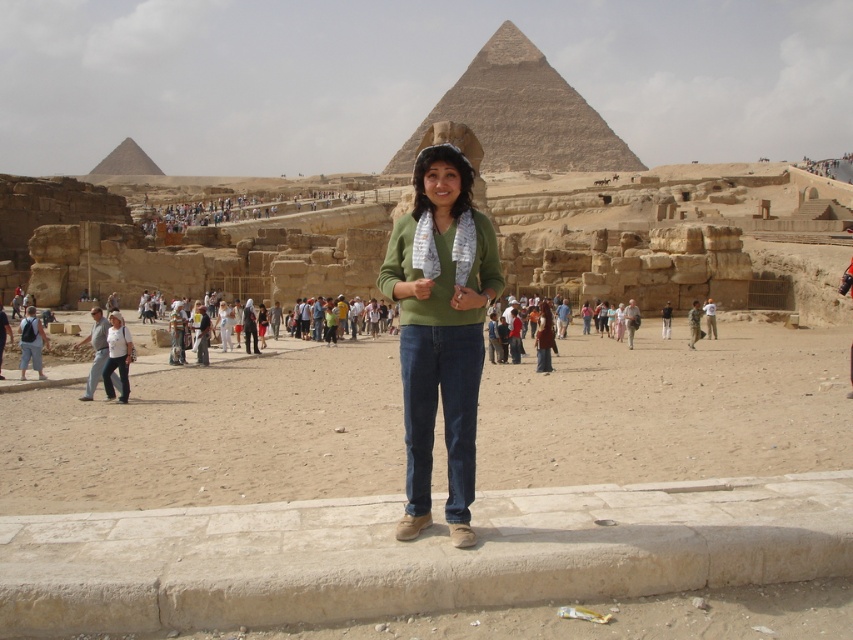
Question: Which point is closer to the camera?

Choices:
 (A) light blue jeans at center
 (B) green sweater at center

Answer: (A)

Question: Considering the real-world distances, which object is closest to the brown stone pyramid at center?

Choices:
 (A) dark blue jeans at left
 (B) light brown leather jacket at lower left
 (C) dark blue jeans at center
 (D) light blue jeans at center

Answer: (D)

Question: Is brown stone pyramid at center wider than dark blue jeans at left?

Choices:
 (A) no
 (B) yes

Answer: (B)

Question: Which object is closer to the camera taking this photo?

Choices:
 (A) light blue jeans at center
 (B) green sweater at center
 (C) green matte sweater at center
 (D) light brown leather jacket at lower left

Answer: (C)

Question: Is brown stone pyramid at center bigger than light brown leather jacket at lower left?

Choices:
 (A) yes
 (B) no

Answer: (A)

Question: Is brown stone pyramid at center positioned behind light gray jeans at center?

Choices:
 (A) yes
 (B) no

Answer: (A)